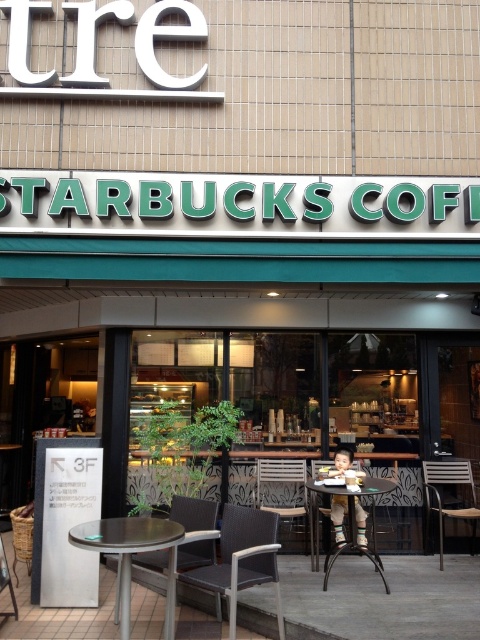
Question: Does brown wooden chair at lower right have a larger size compared to metallic gray chair at lower left?

Choices:
 (A) yes
 (B) no

Answer: (A)

Question: Which point is farther to the camera?

Choices:
 (A) metallic gray chair at lower left
 (B) dark brown woven chair at center

Answer: (A)

Question: Does brown wooden chair at lower right have a larger size compared to metallic gray chair at lower left?

Choices:
 (A) yes
 (B) no

Answer: (A)

Question: Observing the image, what is the correct spatial positioning of dark brown woven chair at center in reference to brown wooden chair at lower right?

Choices:
 (A) above
 (B) below

Answer: (A)

Question: Among these objects, which one is farthest from the camera?

Choices:
 (A) metallic silver chair at center
 (B) dark brown woven chair at center

Answer: (A)

Question: Which of the following is the farthest from the observer?

Choices:
 (A) (307, 492)
 (B) (165, 544)

Answer: (A)